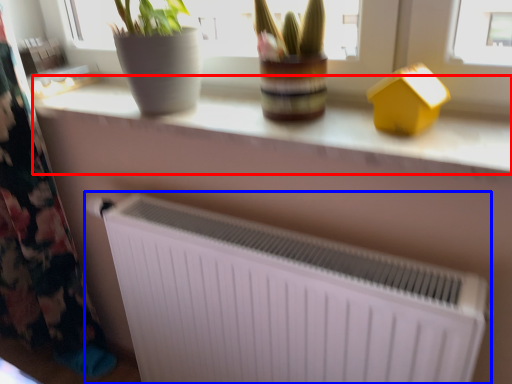
Question: Among these objects, which one is farthest to the camera, counter top (highlighted by a red box) or radiator (highlighted by a blue box)?

Choices:
 (A) counter top
 (B) radiator

Answer: (B)